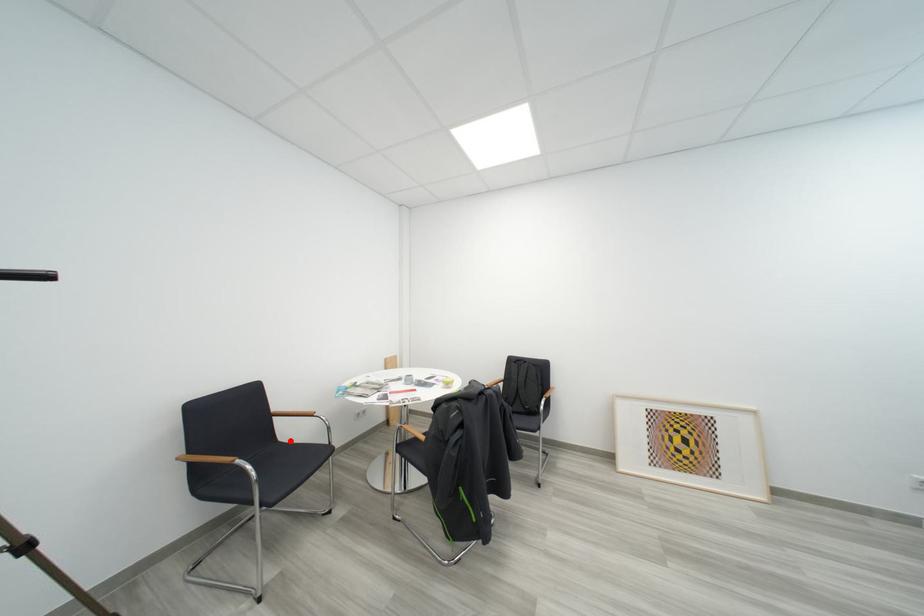
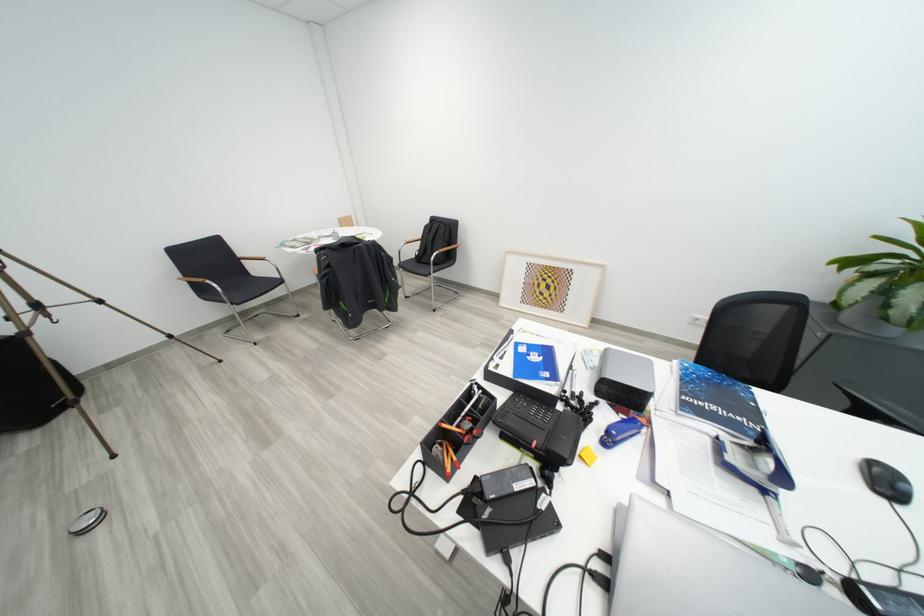
Question: I am providing you with two images of the same scene from different viewpoints. Given a red point in image1, look at the same physical point in image2. Is it:

Choices:
 (A) Closer to the viewpoint
 (B) Farther from the viewpoint

Answer: (A)